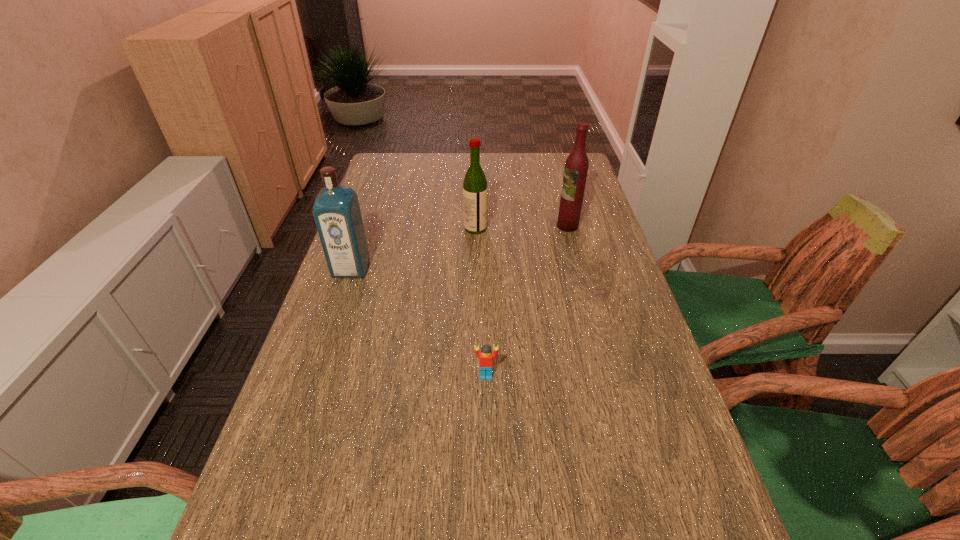
Where is `the rightmost object`? This screenshot has width=960, height=540. the rightmost object is located at coordinates (576, 166).

Where is `the leftmost liquor`? The image size is (960, 540). the leftmost liquor is located at coordinates (336, 210).

Where is `the second nearest object`? the second nearest object is located at coordinates (336, 210).

Identify the location of the second liquor from right to left. Image resolution: width=960 pixels, height=540 pixels. (475, 190).

Identify the location of the nearest object. This screenshot has height=540, width=960. (485, 356).

You are a GUI agent. You are given a task and a screenshot of the screen. Output one action in this format:
    pyautogui.click(x=<x>, y=<y>)
    Task: Click on the shortest object
    The image size is (960, 540).
    Given the screenshot: What is the action you would take?
    pyautogui.click(x=485, y=356)

The image size is (960, 540). Find the location of `vacant point located on the label of the rightmost liquor`. vacant point located on the label of the rightmost liquor is located at coordinates (486, 226).

At what (x,y) coordinates should I click in order to perform the action: click on blank area located on the label of the rightmost liquor. Please return your answer as a coordinate pair (x, y). Looking at the image, I should click on (457, 226).

Locate an element on the screen. This screenshot has height=540, width=960. vacant area situated 0.310m on the label of the rightmost liquor is located at coordinates (457, 226).

The image size is (960, 540). I want to click on vacant region located on the flat label side of the leftmost object, so [332, 324].